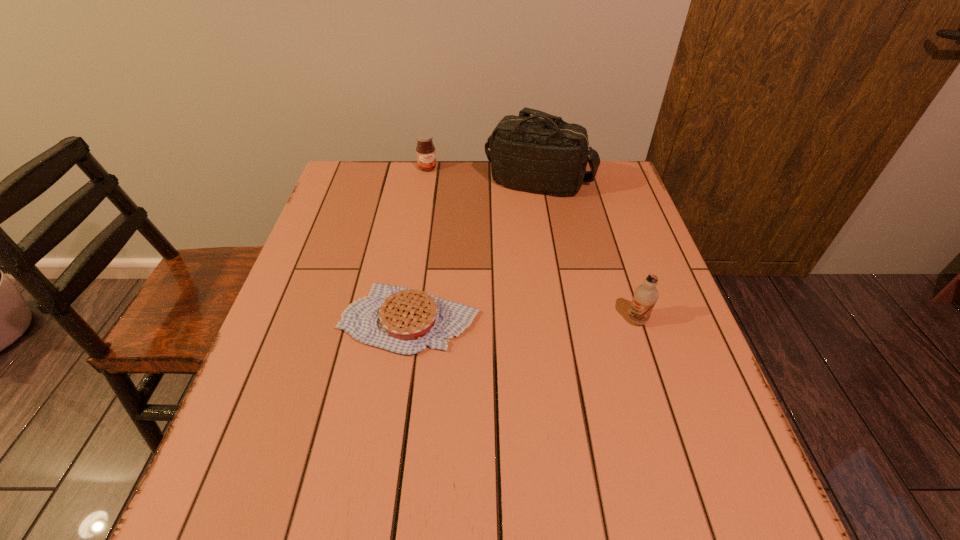
Image resolution: width=960 pixels, height=540 pixels. I want to click on vacant spot on the desktop that is between the shortest object and the chocolate milk and is positioned on the label side of the second shortest object, so click(499, 319).

This screenshot has height=540, width=960. Find the location of `vacant spot on the desktop that is between the shortest object and the third shortest object and is positioned at the front padded panel of the tallest object`. vacant spot on the desktop that is between the shortest object and the third shortest object and is positioned at the front padded panel of the tallest object is located at coordinates (551, 320).